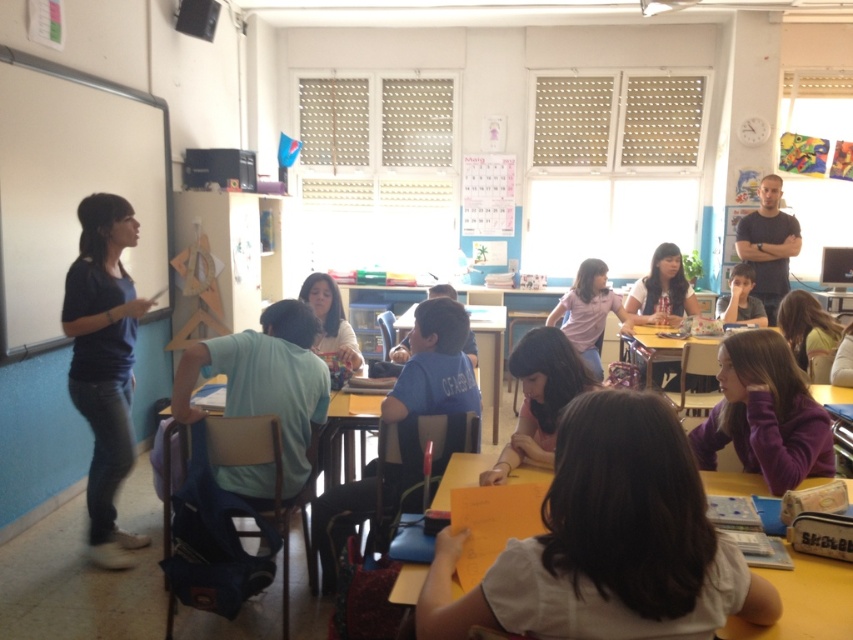
You are standing in the classroom and want to find the purple matte shirt at lower right. According to the coordinates given, where should you look relative to the bottom left corner of the image?

The purple matte shirt at lower right is located at coordinates 0.647 on the x axis and 0.897 on the y axis relative to the bottom left corner of the image.